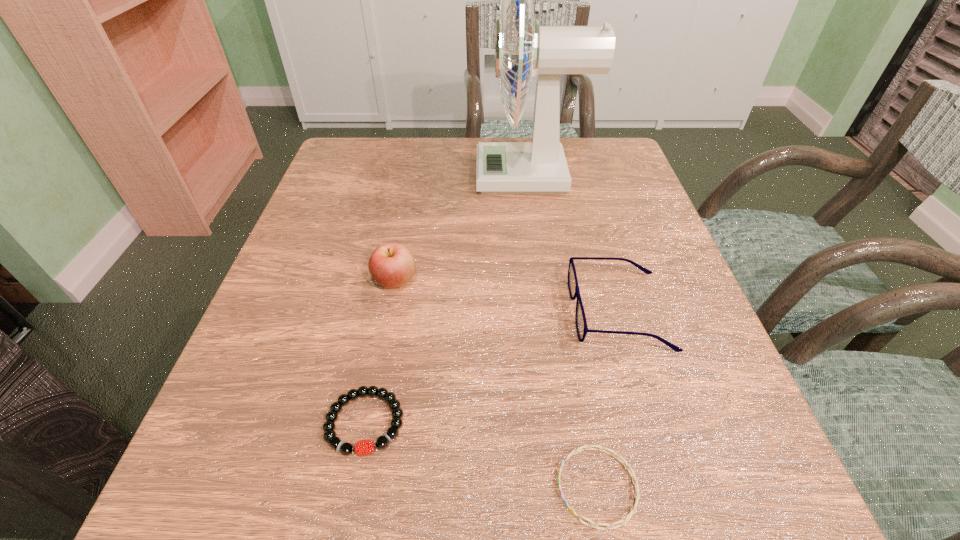
Where is `the farthest object`? This screenshot has height=540, width=960. the farthest object is located at coordinates (538, 167).

Locate an element on the screen. The width and height of the screenshot is (960, 540). fan is located at coordinates (538, 167).

Locate an element on the screen. the fourth shortest object is located at coordinates (391, 265).

Where is `spectacles`? spectacles is located at coordinates (581, 324).

The height and width of the screenshot is (540, 960). What are the coordinates of `the second shortest object` in the screenshot? It's located at (364, 447).

Image resolution: width=960 pixels, height=540 pixels. I want to click on the taller bracelet, so click(x=364, y=447).

Where is `the right bracelet`? The height and width of the screenshot is (540, 960). the right bracelet is located at coordinates (587, 447).

You are a GUI agent. You are given a task and a screenshot of the screen. Output one action in this format:
    pyautogui.click(x=<x>, y=<y>)
    Task: Click on the shorter bracelet
    The image size is (960, 540).
    Given the screenshot: What is the action you would take?
    pyautogui.click(x=587, y=447)

At what (x,y) coordinates should I click in order to perform the action: click on blank area located on the front-facing side of the farthest object. Please return your answer as a coordinate pair (x, y). The height and width of the screenshot is (540, 960). Looking at the image, I should click on (395, 176).

In order to click on free space located 0.280m on the front-facing side of the farthest object in this screenshot , I will do pyautogui.click(x=362, y=176).